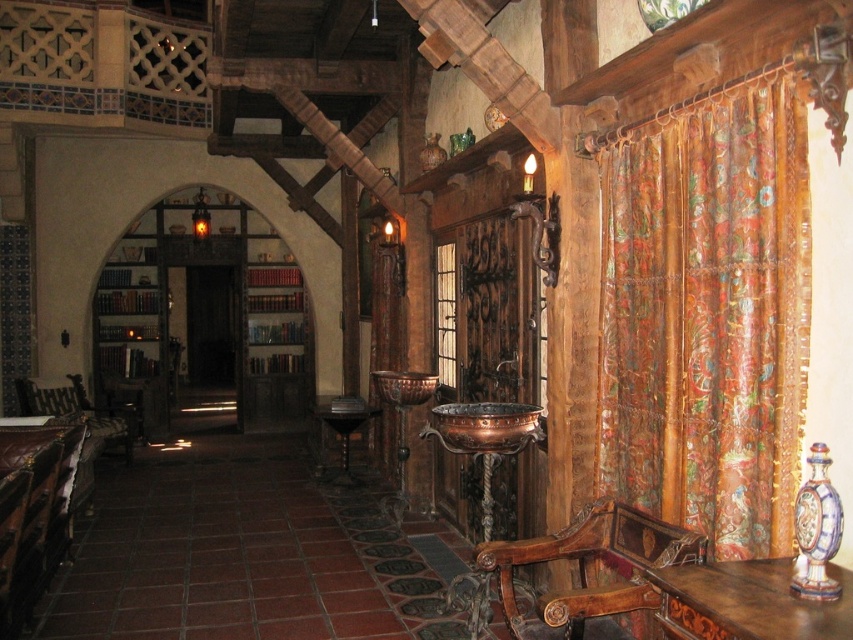
You are a knight standing in the grand medieval room. You need to move from your current position to the wooden table at center. There is a leather cushioned chair at center in the way. Can you walk around it without touching the chair? The room has a minimum clearance of 1 meter required for safe passage.

The leather cushioned chair at center and wooden table at center are 2.63 meters apart. Since the required clearance is 1 meter, there is enough space to navigate around the chair safely. Yes, you can walk around the leather cushioned chair at center without touching it.

You are standing in the grand medieval room and need to sit down. Where is the polished wood chair at center located in relation to the room?

The polished wood chair at center is located at the center of the room at coordinates approximately 0.895 on the x axis and 0.691 on the y axis.

You are standing in the grand medieval room and want to sit down. There is a polished wood chair at center. Can you reach the chair from your current position at point [589,572]?

Yes, you are already at the polished wood chair at center since the point [589,572] is on it.